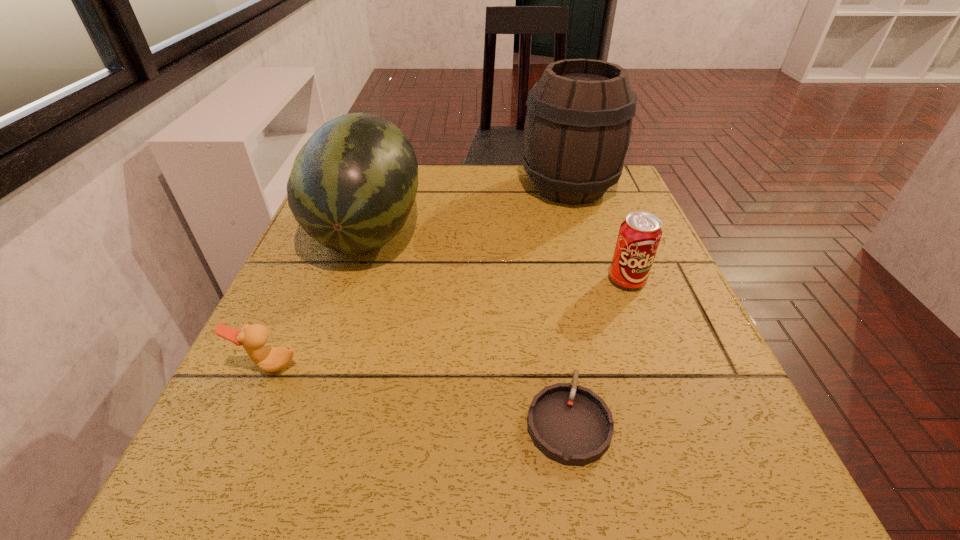
Locate an element on the screen. The height and width of the screenshot is (540, 960). wine bucket is located at coordinates (578, 124).

Find the location of `watermelon`. watermelon is located at coordinates (352, 186).

You are a GUI agent. You are given a task and a screenshot of the screen. Output one action in this format:
    pyautogui.click(x=<x>, y=<y>)
    Task: Click on the third shortest object
    The image size is (960, 540).
    Given the screenshot: What is the action you would take?
    pyautogui.click(x=639, y=236)

The image size is (960, 540). What are the coordinates of `the second nearest object` in the screenshot? It's located at [253, 337].

Locate an element on the screen. the fourth tallest object is located at coordinates (253, 337).

Where is `the shortest object`? The image size is (960, 540). the shortest object is located at coordinates (571, 425).

The width and height of the screenshot is (960, 540). What are the coordinates of `ashtray` in the screenshot? It's located at (571, 425).

You are a GUI agent. You are given a task and a screenshot of the screen. Output one action in this format:
    pyautogui.click(x=<x>, y=<y>)
    Task: Click on the vacant space located on the front of the wine bucket
    This screenshot has width=960, height=540.
    Given the screenshot: What is the action you would take?
    pyautogui.click(x=584, y=236)

The image size is (960, 540). Find the location of `vacant space located 0.080m on the back of the fourth shortest object`. vacant space located 0.080m on the back of the fourth shortest object is located at coordinates (385, 178).

In order to click on vacant space located on the left of the soda in this screenshot , I will do `click(455, 280)`.